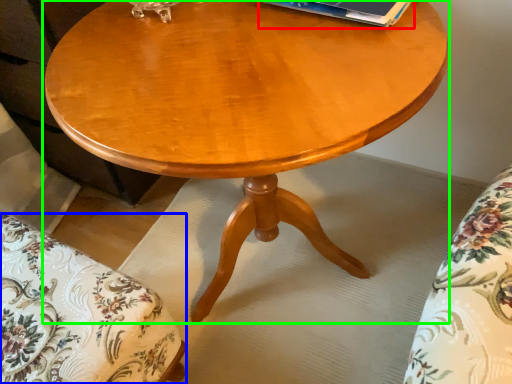
Question: Estimate the real-world distances between objects in this image. Which object is farther from paperback book (highlighted by a red box), swivel chair (highlighted by a blue box) or coffee table (highlighted by a green box)?

Choices:
 (A) swivel chair
 (B) coffee table

Answer: (A)